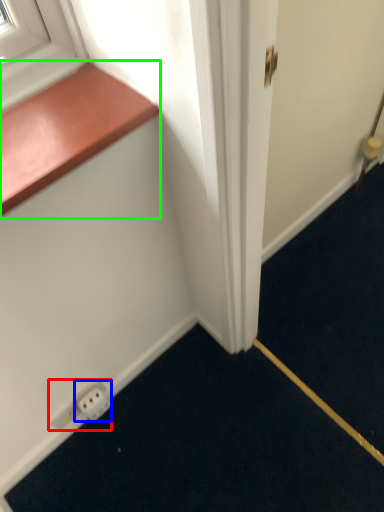
Question: Estimate the real-world distances between objects in this image. Which object is farther from electric outlet (highlighted by a red box), electric outlet (highlighted by a blue box) or window sill (highlighted by a green box)?

Choices:
 (A) electric outlet
 (B) window sill

Answer: (B)